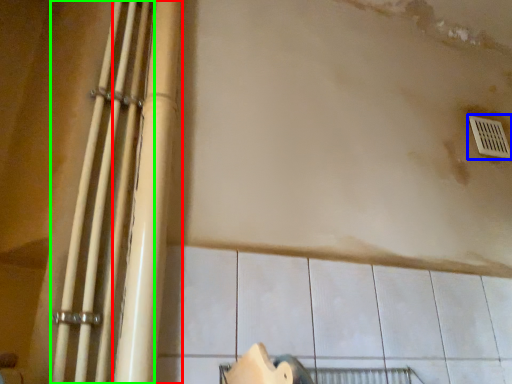
Question: Which object is positioned farthest from beam (highlighted by a red box)? Select from window (highlighted by a blue box) and beam (highlighted by a green box).

Choices:
 (A) window
 (B) beam

Answer: (A)